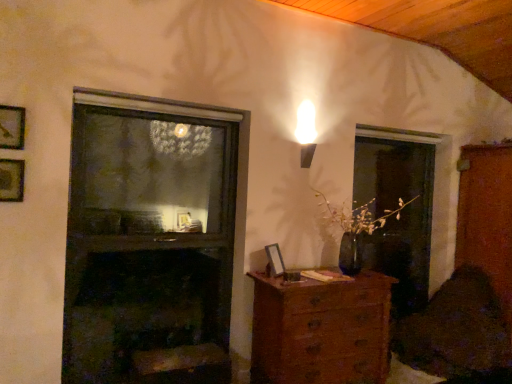
Question: Is wooden picture frame at lower center, which is the first picture frame from back to front, to the left of velvet dark brown swivel chair at lower right from the viewer's perspective?

Choices:
 (A) yes
 (B) no

Answer: (A)

Question: Does wooden picture frame at lower center, which is the first picture frame from back to front, turn towards velvet dark brown swivel chair at lower right?

Choices:
 (A) yes
 (B) no

Answer: (B)

Question: Is the position of wooden picture frame at lower center, positioned as the third picture frame in front-to-back order, less distant than that of velvet dark brown swivel chair at lower right?

Choices:
 (A) no
 (B) yes

Answer: (B)

Question: Is wooden picture frame at lower center, which is counted as the third picture frame, starting from the top, thinner than velvet dark brown swivel chair at lower right?

Choices:
 (A) yes
 (B) no

Answer: (A)

Question: Does wooden picture frame at lower center, which is counted as the third picture frame, starting from the top, have a lesser height compared to velvet dark brown swivel chair at lower right?

Choices:
 (A) no
 (B) yes

Answer: (B)

Question: In terms of height, does dark glass fireplace at center look taller or shorter compared to velvet dark brown swivel chair at lower right?

Choices:
 (A) short
 (B) tall

Answer: (B)

Question: Is dark glass fireplace at center bigger or smaller than velvet dark brown swivel chair at lower right?

Choices:
 (A) big
 (B) small

Answer: (B)

Question: From a real-world perspective, is dark glass fireplace at center physically located above or below velvet dark brown swivel chair at lower right?

Choices:
 (A) below
 (B) above

Answer: (B)

Question: Would you say dark glass fireplace at center is to the left or to the right of velvet dark brown swivel chair at lower right in the picture?

Choices:
 (A) left
 (B) right

Answer: (A)

Question: From the image's perspective, relative to wooden picture frame at upper left, which is the 2th picture frame in back-to-front order, is transparent glass screen door at right above or below?

Choices:
 (A) below
 (B) above

Answer: (A)

Question: In terms of width, does transparent glass screen door at right look wider or thinner when compared to wooden picture frame at upper left, which is the 2th picture frame in back-to-front order?

Choices:
 (A) thin
 (B) wide

Answer: (B)

Question: In terms of size, does transparent glass screen door at right appear bigger or smaller than wooden picture frame at upper left, the second picture frame from the front?

Choices:
 (A) big
 (B) small

Answer: (A)

Question: In the image, is transparent glass screen door at right positioned in front of or behind wooden picture frame at upper left, the third picture frame in the right-to-left sequence?

Choices:
 (A) behind
 (B) front

Answer: (A)

Question: Which is correct: wooden picture frame at upper left, the second picture frame from the front, is inside velvet dark brown swivel chair at lower right, or outside of it?

Choices:
 (A) inside
 (B) outside

Answer: (B)

Question: Considering the positions of wooden picture frame at upper left, the second picture frame viewed from the top, and velvet dark brown swivel chair at lower right in the image, is wooden picture frame at upper left, the second picture frame viewed from the top, taller or shorter than velvet dark brown swivel chair at lower right?

Choices:
 (A) short
 (B) tall

Answer: (A)